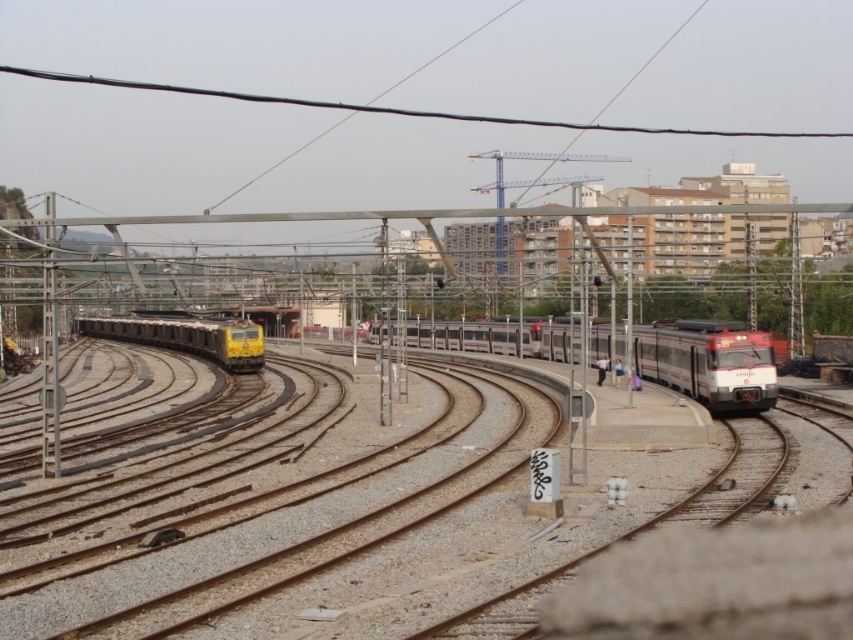
You are a train conductor who needs to determine which train to board first. Considering the size difference between the red glossy train at center and the yellow metallic train at center, which one would require more space for boarding?

The yellow metallic train at center is larger than the red glossy train at center, so it would require more space for boarding.

You are a railway inspector checking the overhead electrical wires. You have two points marked on your map at coordinates point (x=306, y=628) and point (x=636, y=369). Which point is nearer to you as you stand on the concrete platform?

Point (x=306, y=628) is closer to the viewer than point (x=636, y=369), so the point at coordinates point (x=306, y=628) is nearer to you as you stand on the concrete platform.

You are a railway inspector checking the tracks. You notice the red glossy train at center and the yellow metallic train at center. Which train has a narrower body?

The red glossy train at center has a narrower body than the yellow metallic train at center, as its width is less than the yellow metallic train at center.